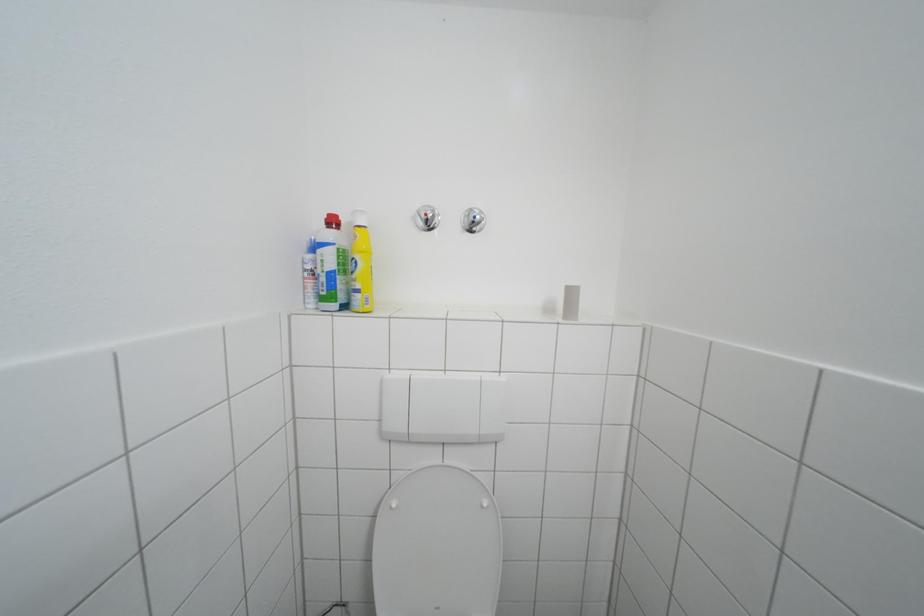
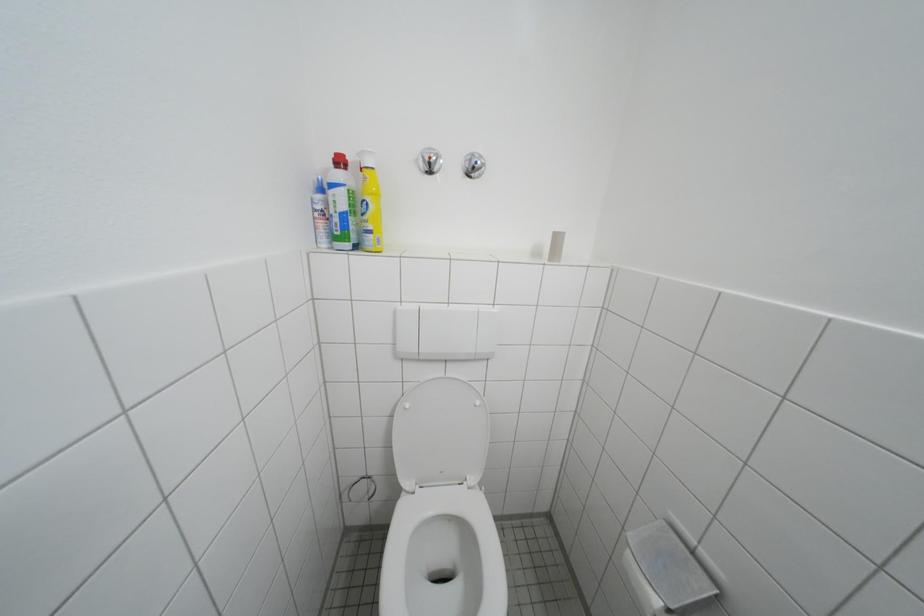
Which direction would the cameraman need to move to produce the second image?

The cameraman moved toward left, backward.